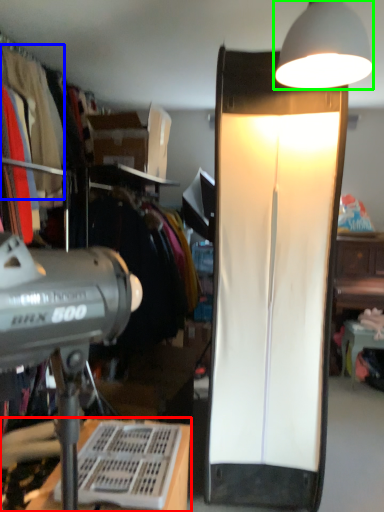
Question: Considering the real-world distances, which object is closest to desk (highlighted by a red box)? clothing (highlighted by a blue box) or lamp (highlighted by a green box).

Choices:
 (A) clothing
 (B) lamp

Answer: (A)